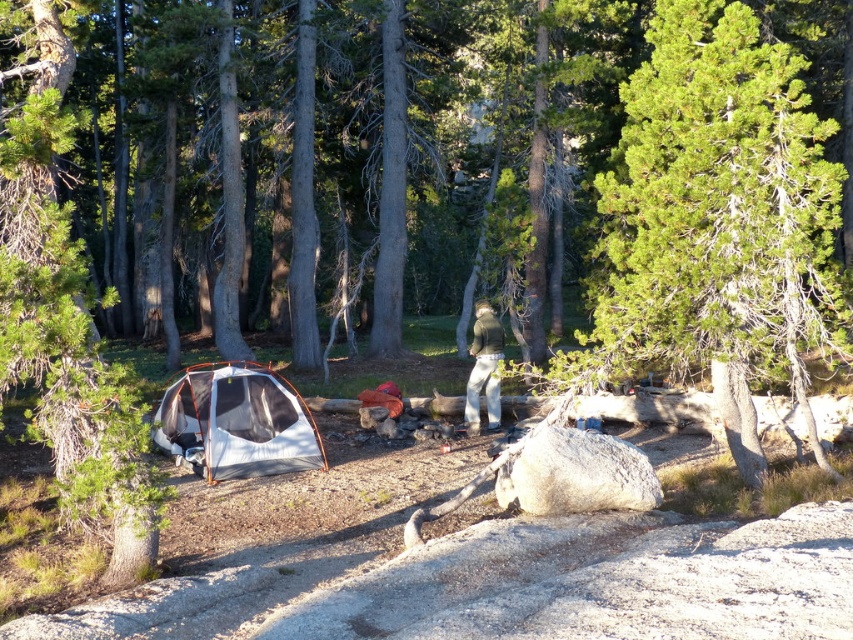
Question: Does green textured tent at lower left come in front of white mesh tent at lower left?

Choices:
 (A) yes
 (B) no

Answer: (A)

Question: Which object is farther from the camera taking this photo?

Choices:
 (A) white mesh tent at lower left
 (B) green textured tent at lower left

Answer: (A)

Question: Is white mesh tent at lower left thinner than green fuzzy sweater at center?

Choices:
 (A) no
 (B) yes

Answer: (A)

Question: Is green textured tent at lower left positioned behind green fuzzy sweater at center?

Choices:
 (A) no
 (B) yes

Answer: (A)

Question: Which point is farther to the camera?

Choices:
 (A) green textured tent at lower left
 (B) green fuzzy sweater at center
 (C) white mesh tent at lower left

Answer: (B)

Question: Among these points, which one is farthest from the camera?

Choices:
 (A) (215, 452)
 (B) (490, 349)

Answer: (B)